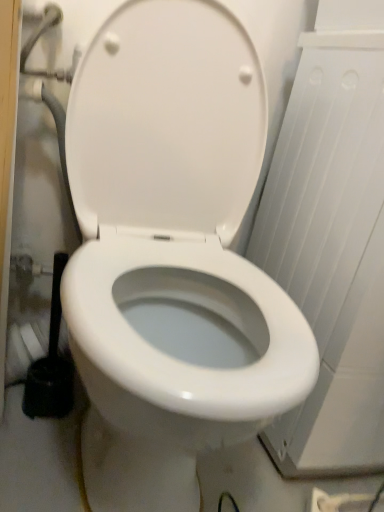
Describe the element at coordinates (51, 365) in the screenshot. Image resolution: width=384 pixels, height=512 pixels. I see `black plastic brush at lower left` at that location.

Measure the distance between point (x=33, y=389) and camera.

Point (x=33, y=389) and camera are 35.12 inches apart.

The image size is (384, 512). In order to click on black plastic brush at lower left in this screenshot , I will do click(x=51, y=365).

The height and width of the screenshot is (512, 384). What are the coordinates of `black plastic brush at lower left` in the screenshot? It's located at (51, 365).